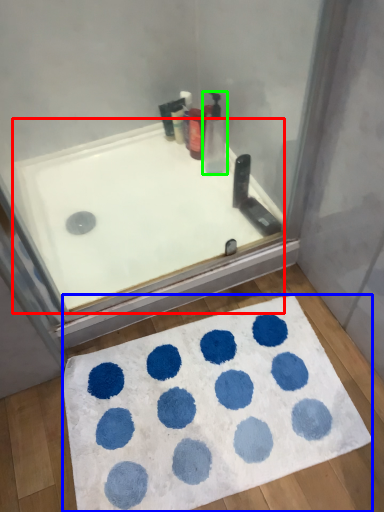
Question: Which is farther away from bathtub (highlighted by a red box)? bath mat (highlighted by a blue box) or cleaning product (highlighted by a green box)?

Choices:
 (A) bath mat
 (B) cleaning product

Answer: (A)